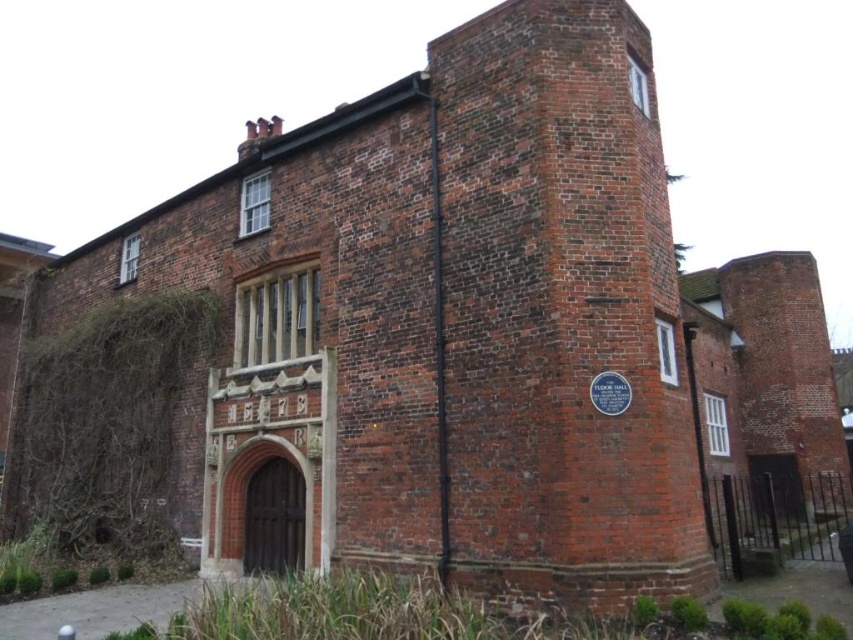
From the picture: Between green leafy ivy at left and white plastic clock at upper right, which one has more height?

Standing taller between the two is white plastic clock at upper right.

Can you confirm if green leafy ivy at left is taller than white plastic clock at upper right?

Incorrect, green leafy ivy at left's height is not larger of white plastic clock at upper right's.

In order to click on green leafy ivy at left in this screenshot , I will do `click(103, 420)`.